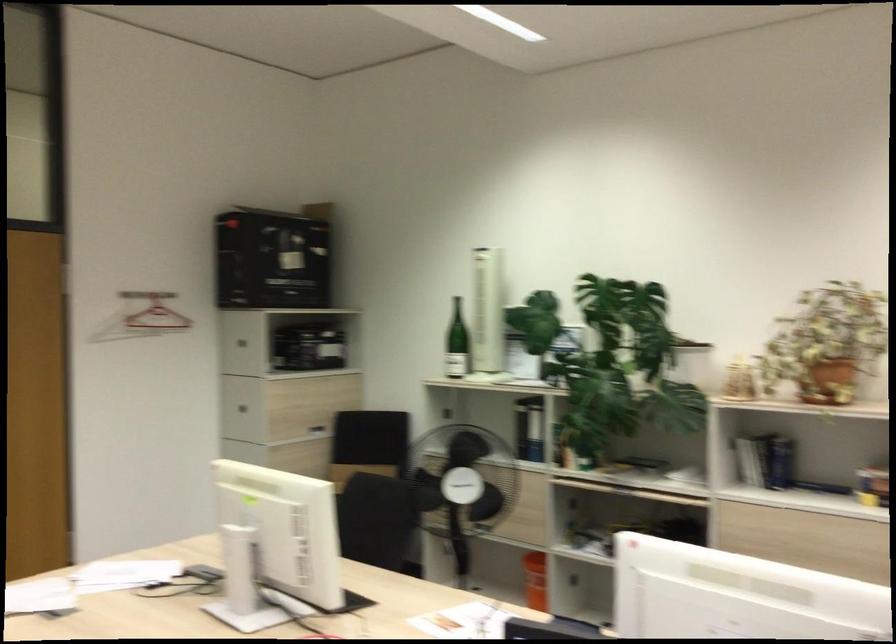
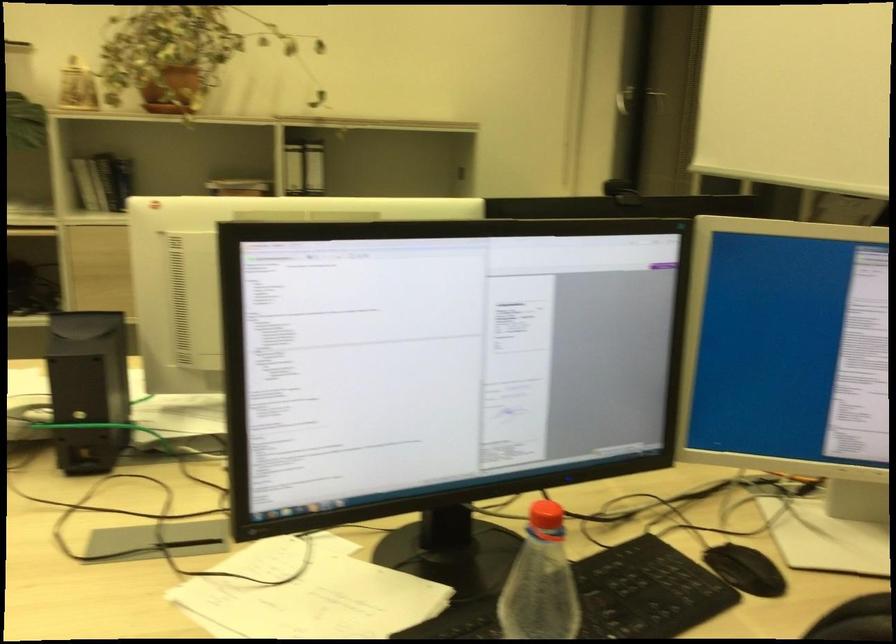
The images are taken continuously from a first-person perspective. In which direction is your viewpoint rotating?

The camera's rotation is toward right-down.